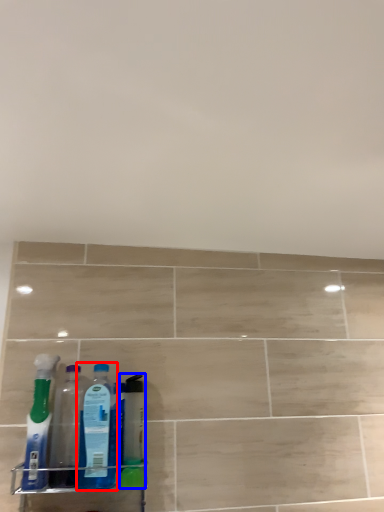
Question: Which point is further to the camera, bottle (highlighted by a red box) or cleaning product (highlighted by a blue box)?

Choices:
 (A) bottle
 (B) cleaning product

Answer: (B)